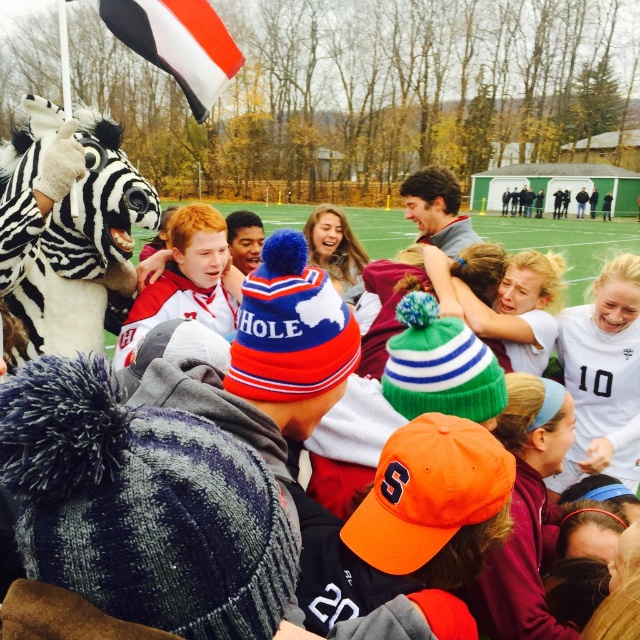
Question: Which of the following is the closest to the observer?

Choices:
 (A) white and black striped plush zebra at left
 (B) white/black striped flag at upper left

Answer: (A)

Question: Among these objects, which one is farthest from the camera?

Choices:
 (A) white/black striped flag at upper left
 (B) white and black striped plush zebra at left

Answer: (A)

Question: Can you confirm if white and black striped plush zebra at left is positioned to the right of white/black striped flag at upper left?

Choices:
 (A) yes
 (B) no

Answer: (B)

Question: Is white and black striped plush zebra at left positioned in front of white/black striped flag at upper left?

Choices:
 (A) no
 (B) yes

Answer: (B)

Question: Is the position of white and black striped plush zebra at left less distant than that of white/black striped flag at upper left?

Choices:
 (A) yes
 (B) no

Answer: (A)

Question: Which point is closer to the camera?

Choices:
 (A) (90, 230)
 (B) (141, 26)

Answer: (B)